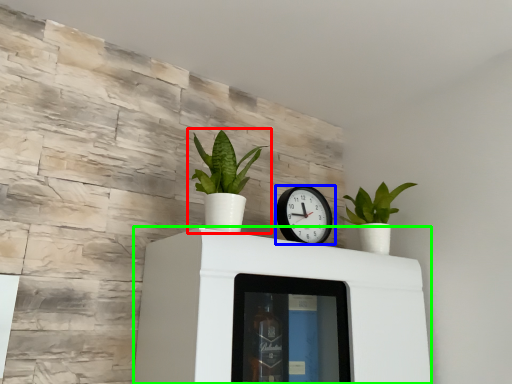
Question: Which object is positioned closest to houseplant (highlighted by a red box)? Select from wall clock (highlighted by a blue box) and furniture (highlighted by a green box).

Choices:
 (A) wall clock
 (B) furniture

Answer: (A)